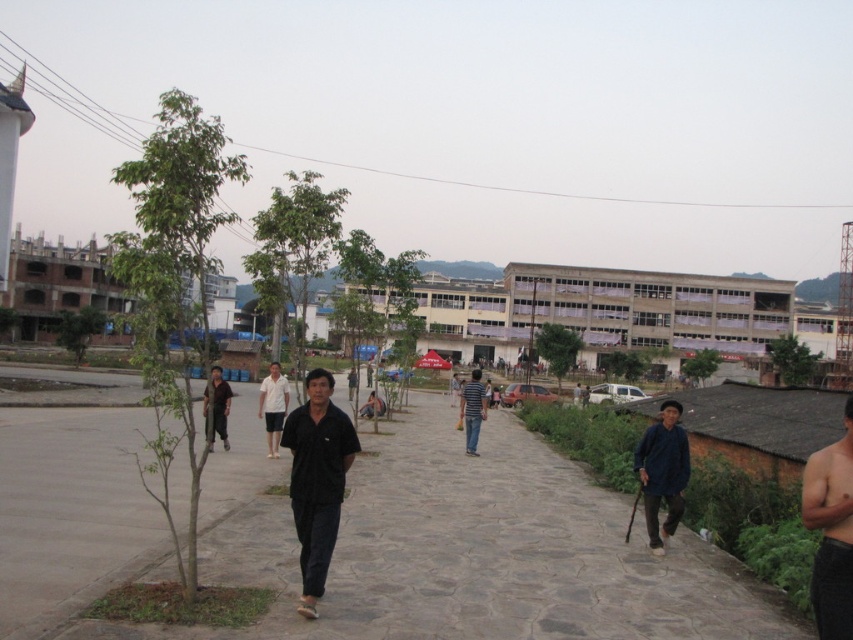
You are standing on the pathway and want to determine which item is narrower between the dark blue fabric at lower right and the white matte shirt at center. Can you tell me which one is narrower?

The dark blue fabric at lower right has a lesser width compared to the white matte shirt at center, so the dark blue fabric at lower right is narrower.